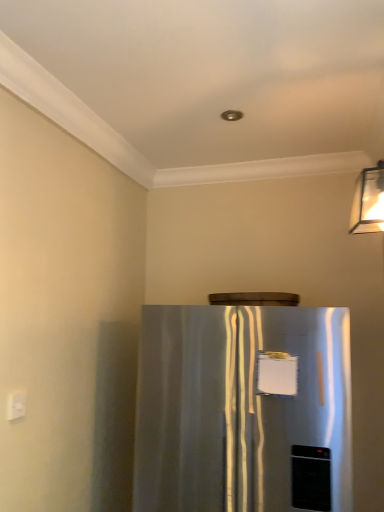
Question: Is white plastic electric outlet at lower left taller or shorter than satin silver refrigerator at center?

Choices:
 (A) short
 (B) tall

Answer: (A)

Question: Looking at their shapes, would you say white plastic electric outlet at lower left is wider or thinner than satin silver refrigerator at center?

Choices:
 (A) wide
 (B) thin

Answer: (B)

Question: Is point (14, 396) positioned closer to the camera than point (329, 321)?

Choices:
 (A) closer
 (B) farther

Answer: (A)

Question: Is satin silver refrigerator at center bigger or smaller than white plastic electric outlet at lower left?

Choices:
 (A) small
 (B) big

Answer: (B)

Question: Would you say satin silver refrigerator at center is to the left or to the right of white plastic electric outlet at lower left in the picture?

Choices:
 (A) left
 (B) right

Answer: (B)

Question: Is satin silver refrigerator at center taller or shorter than white plastic electric outlet at lower left?

Choices:
 (A) tall
 (B) short

Answer: (A)

Question: Is point (155, 361) closer or farther from the camera than point (24, 406)?

Choices:
 (A) closer
 (B) farther

Answer: (B)